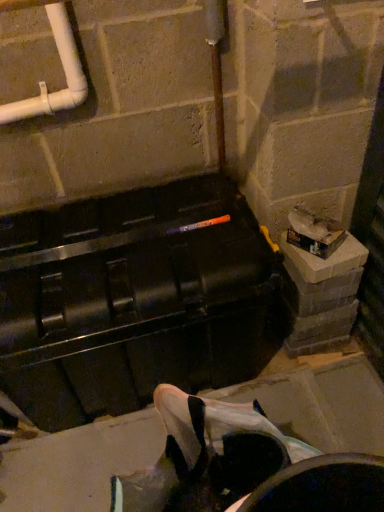
Image resolution: width=384 pixels, height=512 pixels. In order to click on white matte concrete at center in this screenshot , I will do `click(79, 464)`.

Describe the element at coordinates (79, 464) in the screenshot. I see `white matte concrete at center` at that location.

The image size is (384, 512). What are the coordinates of `white matte concrete at center` in the screenshot? It's located at (79, 464).